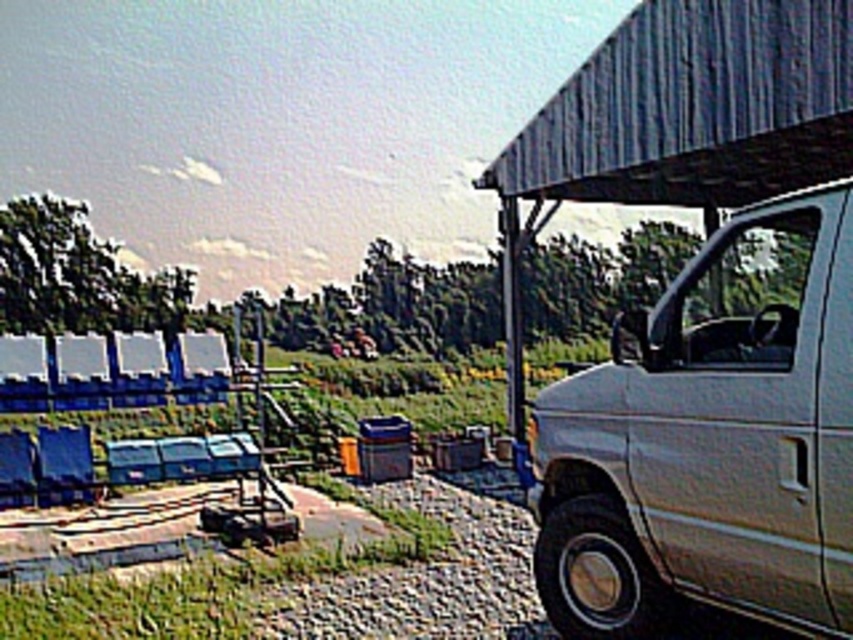
Can you confirm if white matte van at right is shorter than metallic gray awning at upper right?

Yes.

The image size is (853, 640). Describe the element at coordinates (711, 436) in the screenshot. I see `white matte van at right` at that location.

Where is `white matte van at right`? The width and height of the screenshot is (853, 640). white matte van at right is located at coordinates (711, 436).